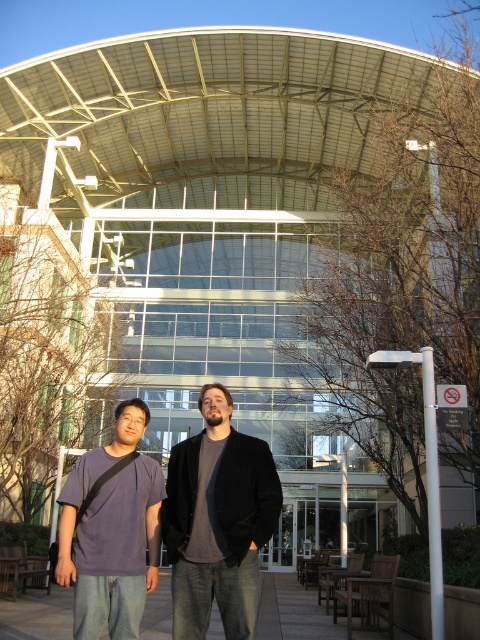
Question: Does matte purple t-shirt at center appear over smooth concrete pavement at center?

Choices:
 (A) yes
 (B) no

Answer: (A)

Question: Which point is closer to the camera taking this photo?

Choices:
 (A) (4, 621)
 (B) (195, 593)
 (C) (96, 461)

Answer: (B)

Question: Estimate the real-world distances between objects in this image. Which object is farther from the matte purple t-shirt at center?

Choices:
 (A) smooth concrete pavement at center
 (B) dark gray fleece jacket at center

Answer: (A)

Question: Can you confirm if dark gray fleece jacket at center is smaller than matte purple t-shirt at center?

Choices:
 (A) yes
 (B) no

Answer: (B)

Question: Which object is positioned farthest from the matte purple t-shirt at center?

Choices:
 (A) smooth concrete pavement at center
 (B) dark gray fleece jacket at center

Answer: (A)

Question: Is matte purple t-shirt at center positioned before smooth concrete pavement at center?

Choices:
 (A) no
 (B) yes

Answer: (B)